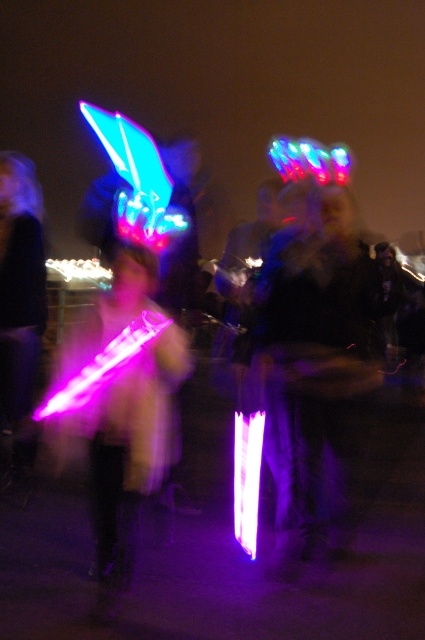
Identify the location of neon plastic light stick at center. (311, 358).

Is neon plastic light stick at center further to the viewer compared to glowing plastic sword at center?

That is True.

Who is more forward, (345, 396) or (150, 298)?

Point (150, 298) is in front.

What are the coordinates of `neon plastic light stick at center` in the screenshot? It's located at (311, 358).